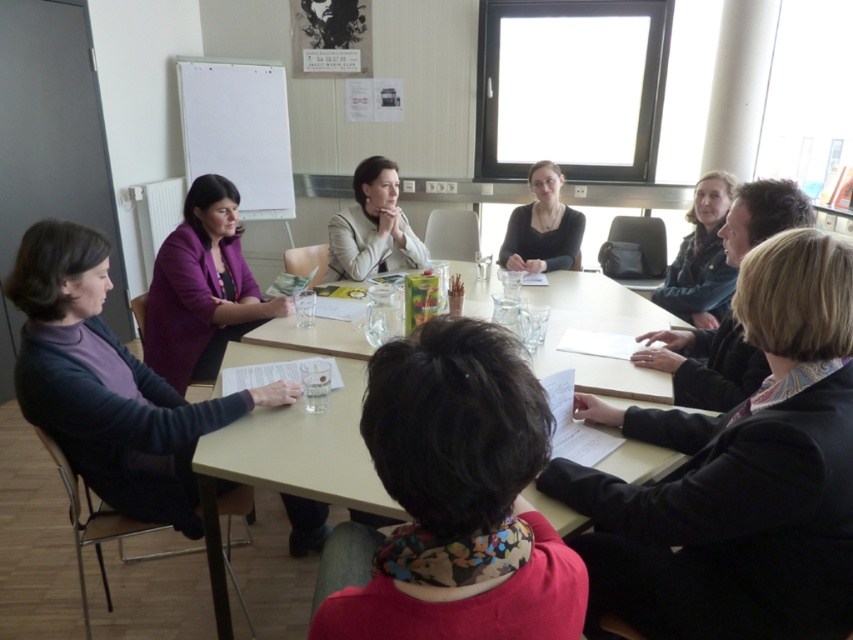
You are organizing a photo shoot and need to ensure that all items in the scene are visible in the final image. Given that the dark brown hair at center and the dark gray sweater at lower left are two key elements, which one might require more attention in terms of framing to ensure it doesn not get lost in the composition?

The dark brown hair at center is smaller than the dark gray sweater at lower left, so it might require more attention in framing to ensure it doesn not get lost in the composition.

You are standing at the entrance of the meeting room and notice the dark gray sweater at lower left. Can you determine its exact position using the coordinate system provided?

The dark gray sweater at lower left is located at point (108, 384), so it is positioned at those coordinates in the image.